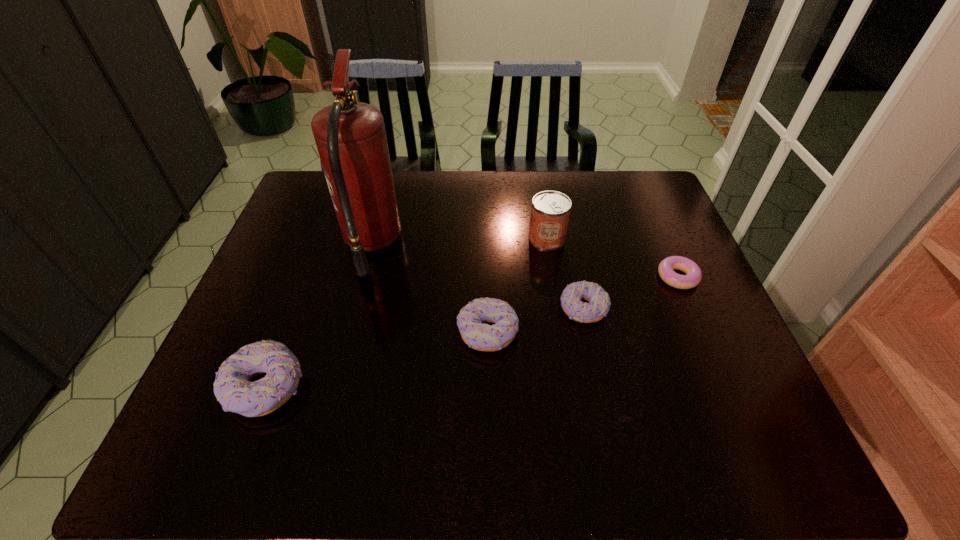
Locate an element on the screen. This screenshot has width=960, height=540. vacant area that lies between the fifth tallest object and the third shortest object is located at coordinates (536, 320).

You are a GUI agent. You are given a task and a screenshot of the screen. Output one action in this format:
    pyautogui.click(x=<x>, y=<y>)
    Task: Click on the unoccupied area between the third doughnut from left to right and the tallest object
    
    Given the screenshot: What is the action you would take?
    pyautogui.click(x=477, y=276)

This screenshot has height=540, width=960. Identify the location of free space between the tallest object and the third shortest object. (430, 288).

Find the location of a particular element. The height and width of the screenshot is (540, 960). vacant space that's between the second shortest object and the second tallest doughnut is located at coordinates (536, 320).

Point out which object is positioned as the second nearest to the second shortest doughnut. Please provide its 2D coordinates. Your answer should be formatted as a tuple, i.e. [(x, y)], where the tuple contains the x and y coordinates of a point satisfying the conditions above.

[(550, 211)]

I want to click on object that is the third closest to the tallest object, so click(x=550, y=211).

Select which doughnut appears as the closest to the fire extinguisher. Please provide its 2D coordinates. Your answer should be formatted as a tuple, i.e. [(x, y)], where the tuple contains the x and y coordinates of a point satisfying the conditions above.

[(471, 321)]

You are a GUI agent. You are given a task and a screenshot of the screen. Output one action in this format:
    pyautogui.click(x=<x>, y=<y>)
    Task: Click on the doughnut that stands as the closest to the fifth shortest object
    The width and height of the screenshot is (960, 540).
    Given the screenshot: What is the action you would take?
    pyautogui.click(x=599, y=303)

This screenshot has height=540, width=960. Identify the location of vacant area in the image that satisfies the following two spatial constraints: 1. on the back side of the third tallest doughnut; 2. at the front of the tallest object where the nozzle is aimed. (569, 245).

Locate an element on the screen. The image size is (960, 540). free space that satisfies the following two spatial constraints: 1. at the front of the fire extinguisher where the nozzle is aimed; 2. on the left side of the third doughnut from right to left is located at coordinates (349, 332).